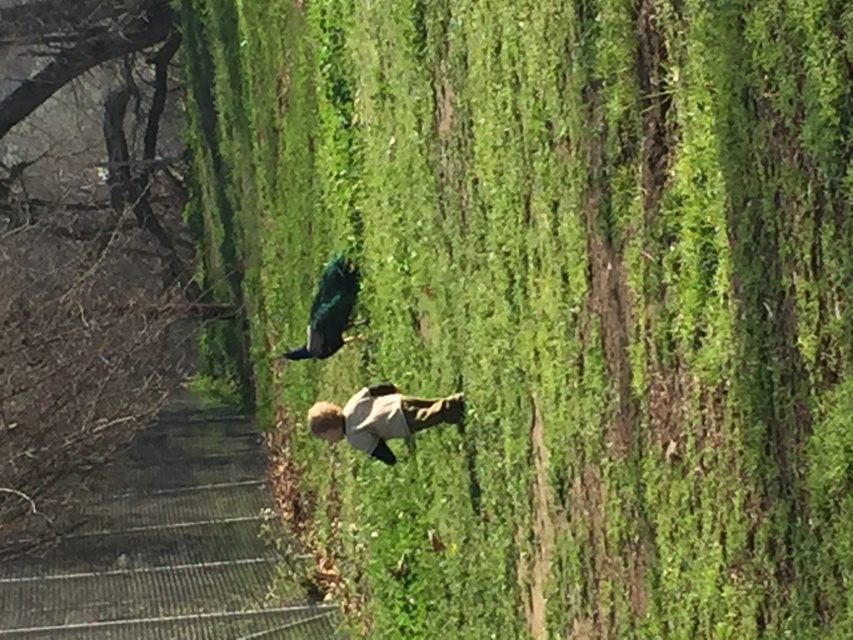
How far apart are light beige cotton pants at center and shiny teal bird at center?

A distance of 1.13 meters exists between light beige cotton pants at center and shiny teal bird at center.

How far apart are light beige cotton pants at center and shiny teal bird at center?

The distance of light beige cotton pants at center from shiny teal bird at center is 1.13 meters.

The image size is (853, 640). What do you see at coordinates (381, 417) in the screenshot?
I see `light beige cotton pants at center` at bounding box center [381, 417].

You are a GUI agent. You are given a task and a screenshot of the screen. Output one action in this format:
    pyautogui.click(x=<x>, y=<y>)
    Task: Click on the light beige cotton pants at center
    This screenshot has width=853, height=640.
    Given the screenshot: What is the action you would take?
    pyautogui.click(x=381, y=417)

Does metallic fence at lower left appear on the right side of shiny teal bird at center?

No, metallic fence at lower left is not to the right of shiny teal bird at center.

Does metallic fence at lower left come behind shiny teal bird at center?

Yes, metallic fence at lower left is behind shiny teal bird at center.

This screenshot has height=640, width=853. I want to click on metallic fence at lower left, so click(165, 545).

Can you confirm if metallic fence at lower left is positioned below light beige cotton pants at center?

Yes, metallic fence at lower left is below light beige cotton pants at center.

Who is more forward, (225, 627) or (395, 428)?

Point (395, 428) is in front.

Is point (128, 568) positioned behind point (408, 419)?

Yes, it is behind point (408, 419).

I want to click on metallic fence at lower left, so click(165, 545).